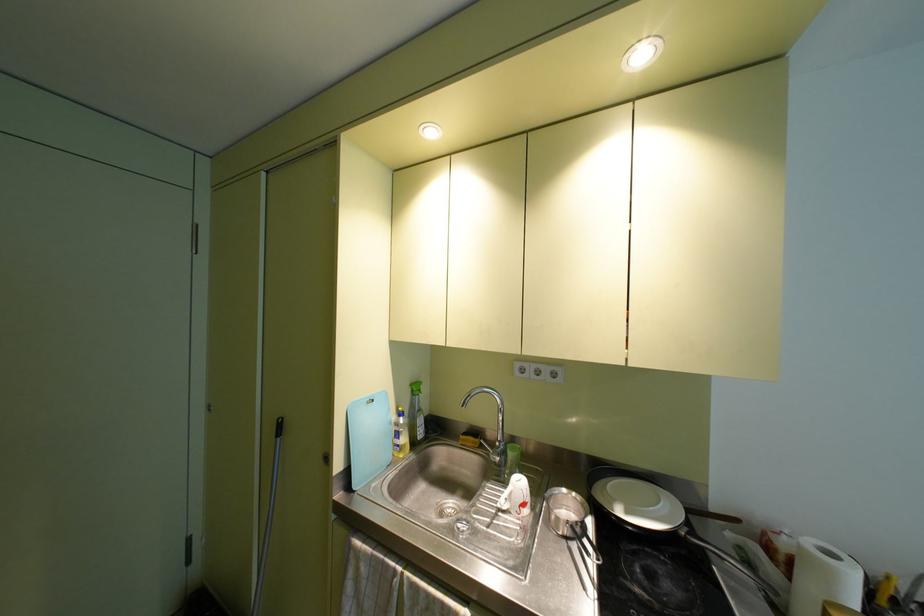
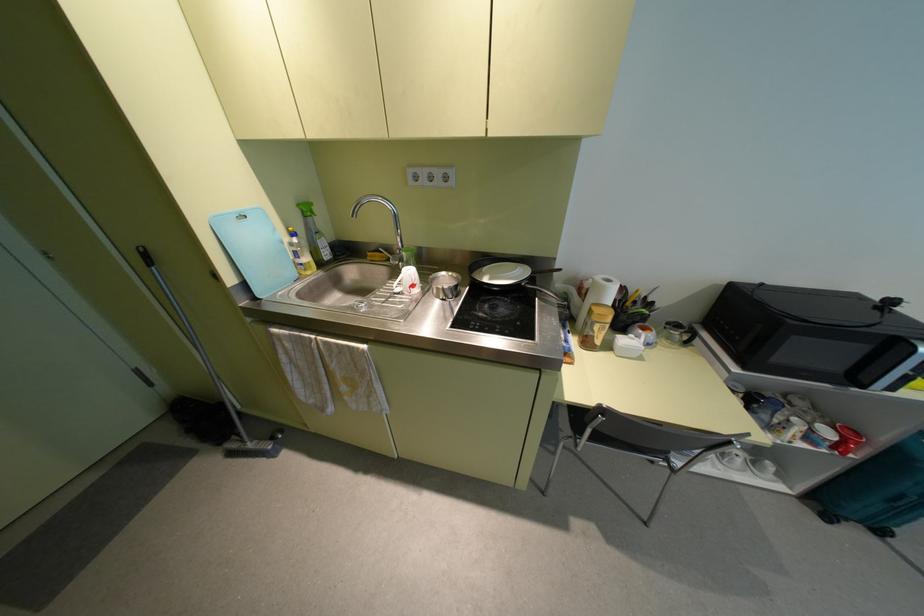
Locate, in the second image, the point that corresponds to (x=399, y=413) in the first image.

(293, 233)